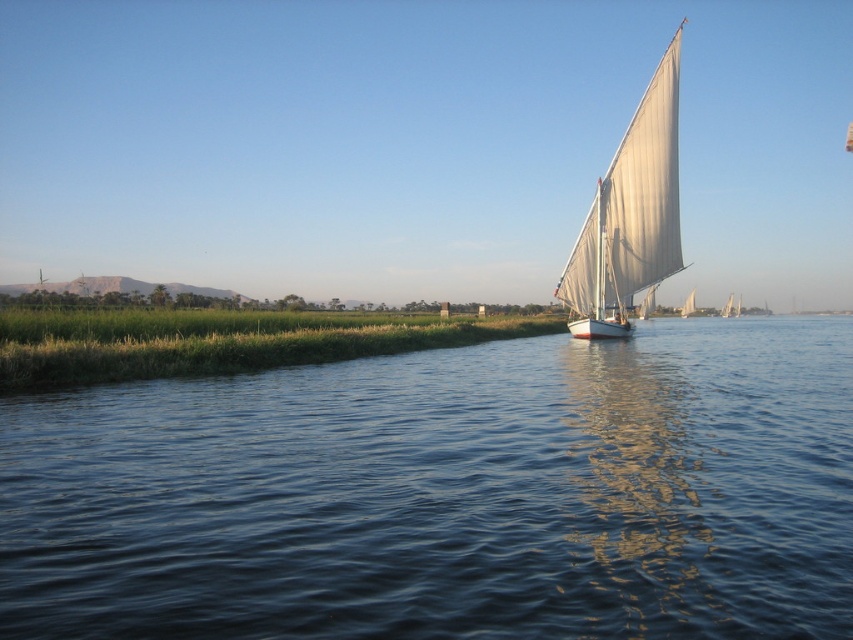
Which is in front, point (535, 548) or point (670, 248)?

Positioned in front is point (535, 548).

Is point (363, 460) farther from camera compared to point (625, 266)?

No, (363, 460) is closer to viewer.

The height and width of the screenshot is (640, 853). I want to click on blue water at center, so coord(448,493).